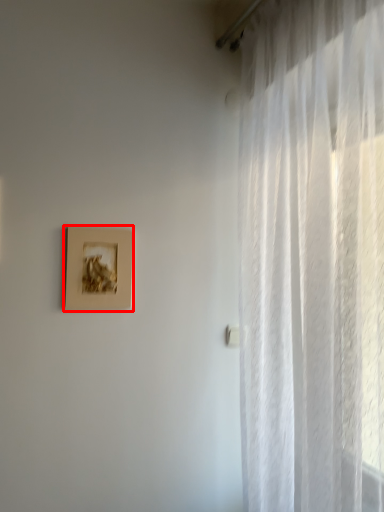
Question: From the image's perspective, considering the relative positions of picture frame (annotated by the red box) and curtain in the image provided, where is picture frame (annotated by the red box) located with respect to the staircase?

Choices:
 (A) below
 (B) above

Answer: (B)